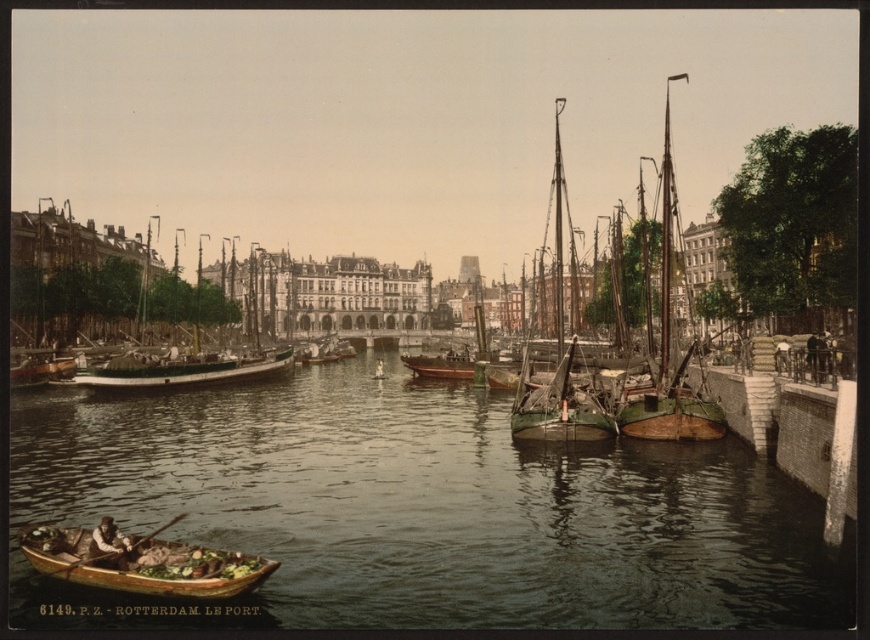
Question: Which object is closer to the camera taking this photo?

Choices:
 (A) green matte sailboat at center
 (B) wooden canoe at lower left
 (C) wooden boat at left
 (D) greenish water at center

Answer: (D)

Question: Does greenish water at center come in front of green matte sailboat at center?

Choices:
 (A) yes
 (B) no

Answer: (A)

Question: Is green matte sailboat at center to the right of wooden boat at left from the viewer's perspective?

Choices:
 (A) yes
 (B) no

Answer: (A)

Question: Which point appears closest to the camera in this image?

Choices:
 (A) (144, 360)
 (B) (647, 396)
 (C) (37, 529)

Answer: (C)

Question: Considering the relative positions of wooden canoe at lower left and green matte sailboat at center in the image provided, where is wooden canoe at lower left located with respect to green matte sailboat at center?

Choices:
 (A) right
 (B) left

Answer: (B)

Question: Which object is farther from the camera taking this photo?

Choices:
 (A) wooden canoe at lower left
 (B) greenish water at center

Answer: (A)